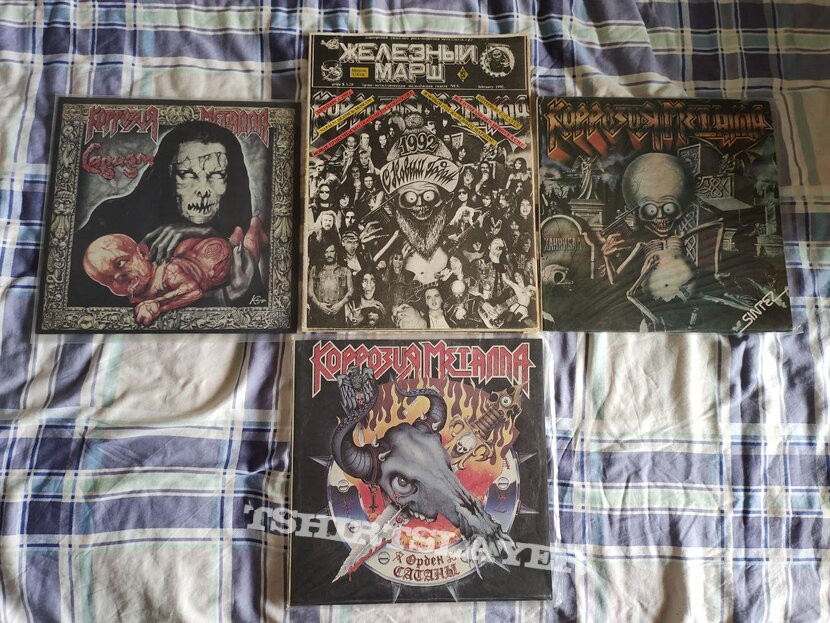
Locate an element on the screen. The height and width of the screenshot is (623, 830). bed is located at coordinates (613, 362).